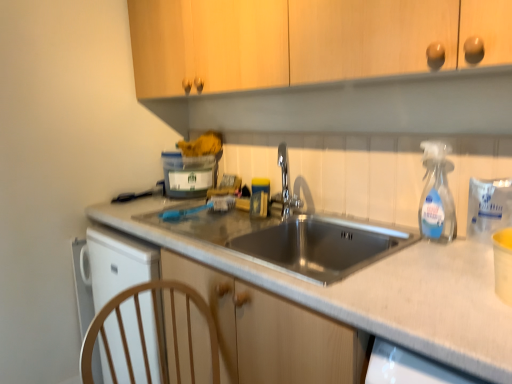
Where is `free spot above translucent plastic container at upper center (from a real-world perspective)`? The height and width of the screenshot is (384, 512). free spot above translucent plastic container at upper center (from a real-world perspective) is located at coordinates (184, 152).